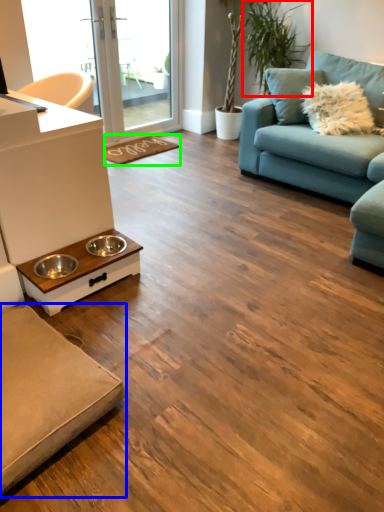
Question: Estimate the real-world distances between objects in this image. Which object is farther from plant (highlighted by a red box), studio couch (highlighted by a blue box) or doormat (highlighted by a green box)?

Choices:
 (A) studio couch
 (B) doormat

Answer: (A)